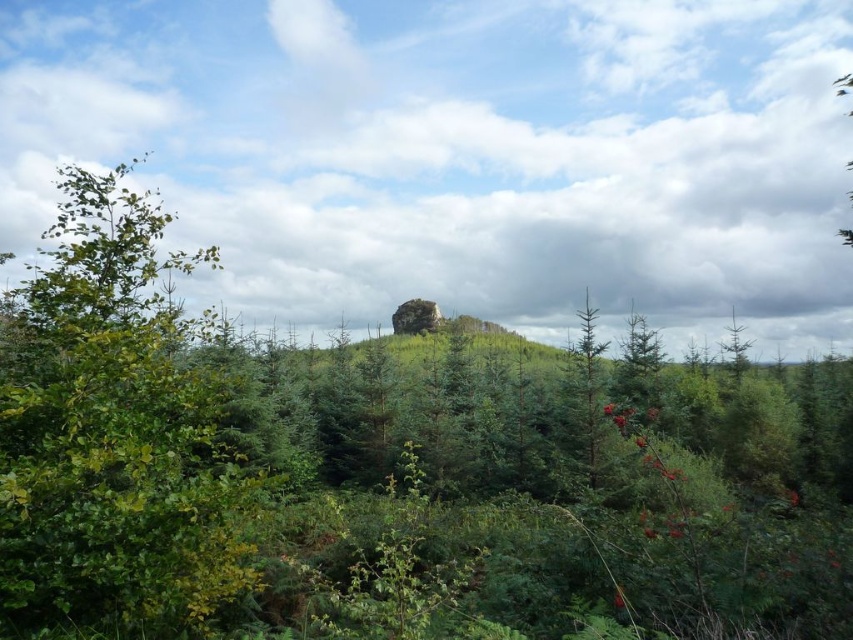
Can you confirm if white fluffy cloud at upper center is wider than green matte tree at center?

Indeed, white fluffy cloud at upper center has a greater width compared to green matte tree at center.

Is point (654, 33) behind point (595, 477)?

Yes, point (654, 33) is farther from viewer.

Is point (402, 54) positioned after point (596, 403)?

That is True.

What are the coordinates of `white fluffy cloud at upper center` in the screenshot? It's located at (461, 154).

Which is behind, point (345, 275) or point (85, 458)?

Point (345, 275)

Who is higher up, white fluffy cloud at upper center or green leafy tree at left?

Positioned higher is white fluffy cloud at upper center.

Where is `white fluffy cloud at upper center`? Image resolution: width=853 pixels, height=640 pixels. white fluffy cloud at upper center is located at coordinates (461, 154).

The image size is (853, 640). I want to click on white fluffy cloud at upper center, so click(461, 154).

Who is shorter, green leafy tree at left or green matte tree at center?

green leafy tree at left

Is green leafy tree at left closer to camera compared to green matte tree at center?

Result: Yes, it is in front of green matte tree at center.

Who is more distant from viewer, (x=0, y=618) or (x=590, y=362)?

Point (x=590, y=362)

This screenshot has height=640, width=853. Identify the location of green leafy tree at left. (115, 433).